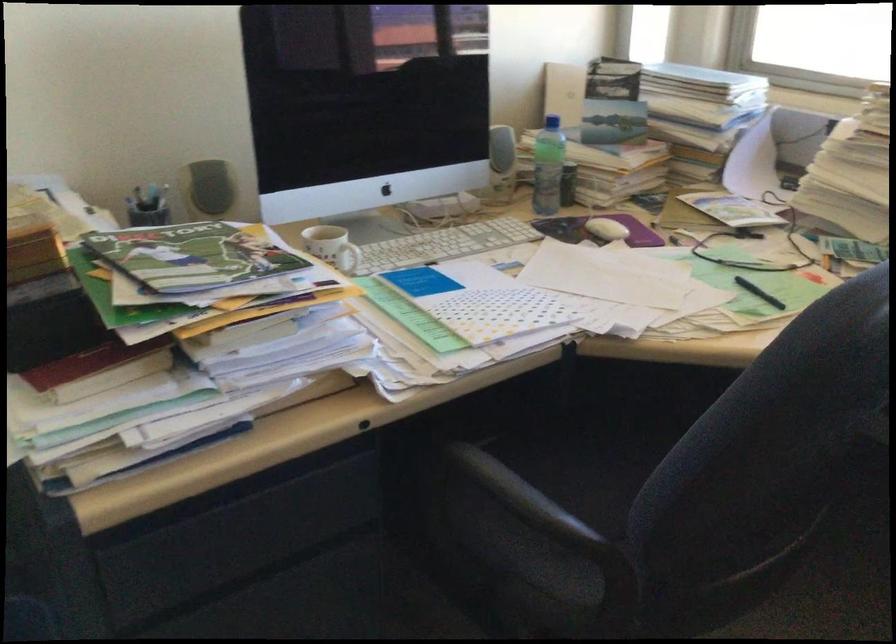
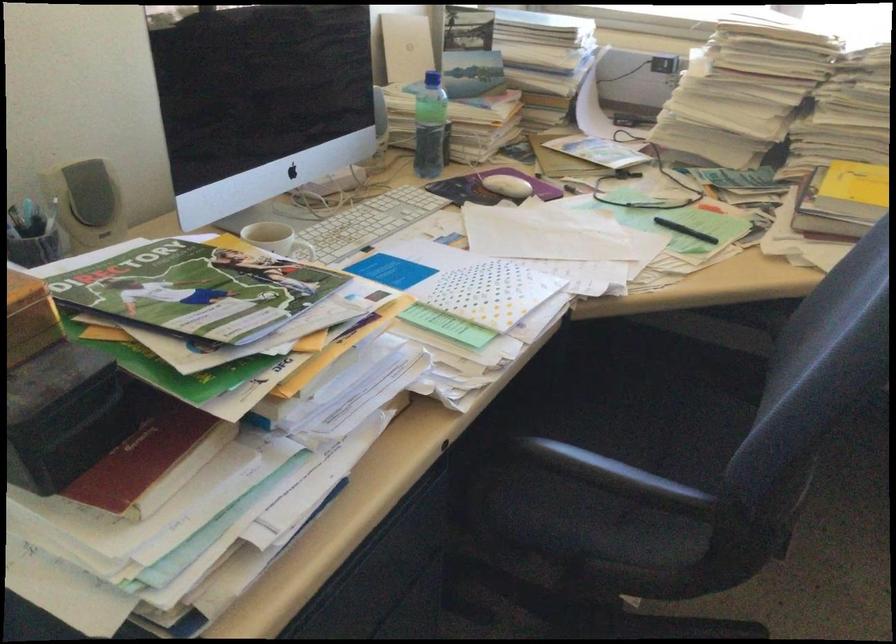
Locate, in the second image, the point that corresponds to point (598, 228) in the first image.

(506, 185)